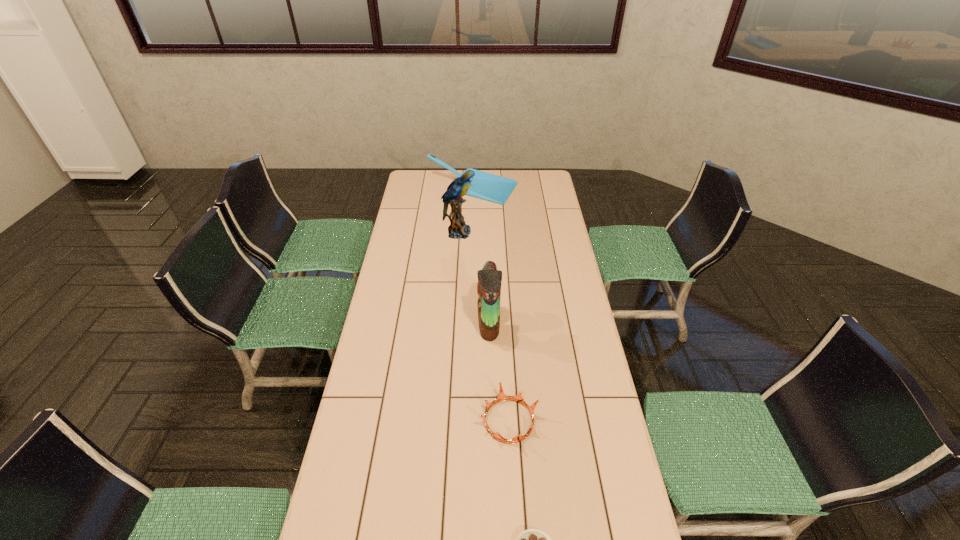
In the image, there is a desktop. Where is `vacant region at the far right corner`? vacant region at the far right corner is located at coordinates (534, 179).

The width and height of the screenshot is (960, 540). What are the coordinates of `free space between the third nearest object and the second nearest object` in the screenshot? It's located at (499, 372).

Where is `empty location between the dustpan and the shorter parrot`? empty location between the dustpan and the shorter parrot is located at coordinates (481, 256).

The height and width of the screenshot is (540, 960). What are the coordinates of `vacant space that is in between the dustpan and the third nearest object` in the screenshot? It's located at [481, 256].

What are the coordinates of `vacant region between the crown and the right parrot` in the screenshot? It's located at (499, 372).

Identify which object is located as the second nearest to the third nearest object. Please provide its 2D coordinates. Your answer should be formatted as a tuple, i.e. [(x, y)], where the tuple contains the x and y coordinates of a point satisfying the conditions above.

[(458, 229)]

Locate which object ranks third in proximity to the dustpan. Please provide its 2D coordinates. Your answer should be formatted as a tuple, i.e. [(x, y)], where the tuple contains the x and y coordinates of a point satisfying the conditions above.

[(501, 397)]

Find the location of a particular element. The width and height of the screenshot is (960, 540). blank area in the image that satisfies the following two spatial constraints: 1. on the front side of the crown; 2. on the right side of the dustpan is located at coordinates (467, 421).